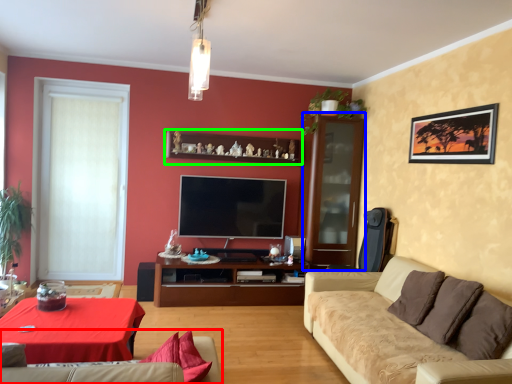
Question: Which is farther away from studio couch (highlighted by a red box)? glass door (highlighted by a blue box) or shelf (highlighted by a green box)?

Choices:
 (A) glass door
 (B) shelf

Answer: (A)